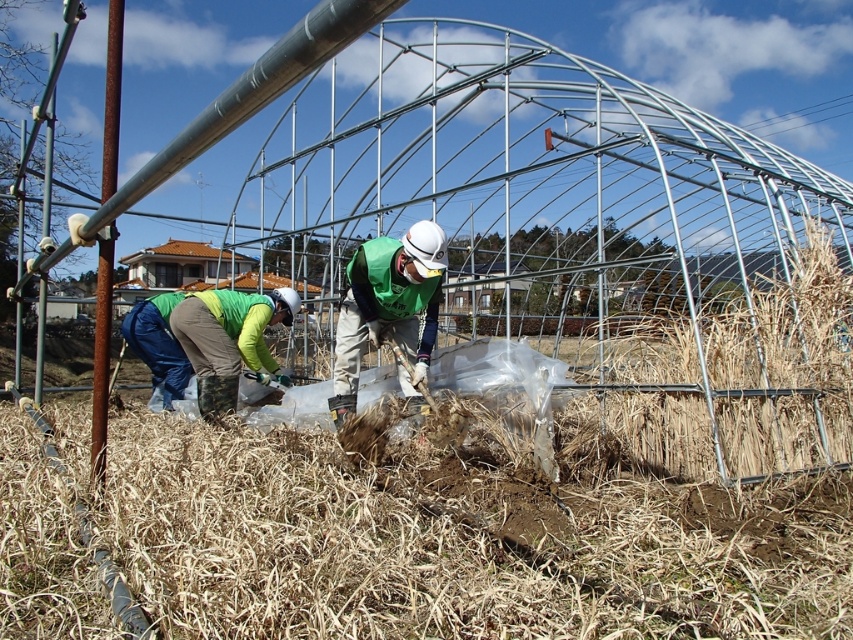
Can you confirm if green fabric worker at center is thinner than green fabric jacket at lower left?

Yes, green fabric worker at center is thinner than green fabric jacket at lower left.

Is green fabric worker at center closer to the viewer compared to green fabric jacket at lower left?

Yes, green fabric worker at center is closer to the viewer.

Between point (349, 288) and point (202, 333), which one is positioned in front?

Point (349, 288)

Find the location of `green fabric worker at center`. green fabric worker at center is located at coordinates click(x=387, y=305).